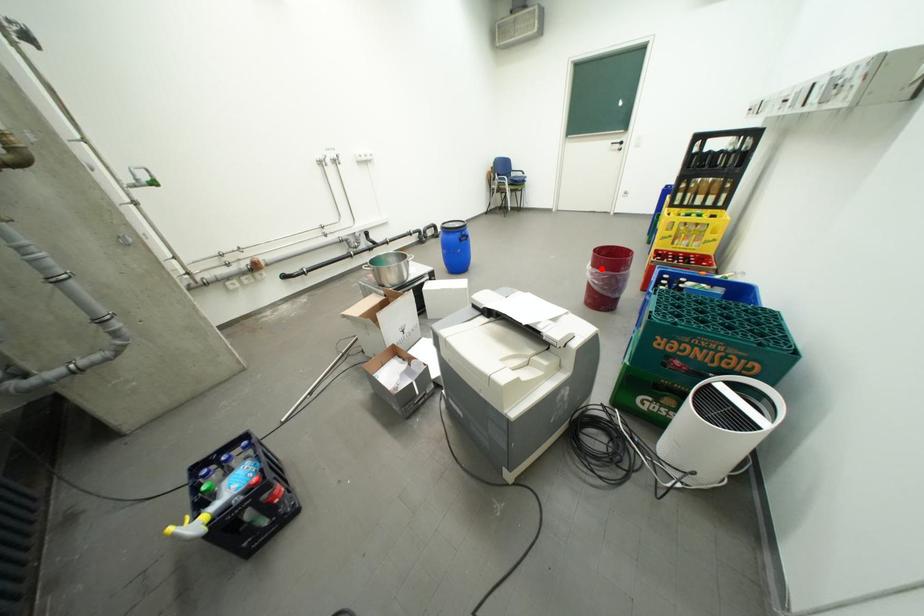
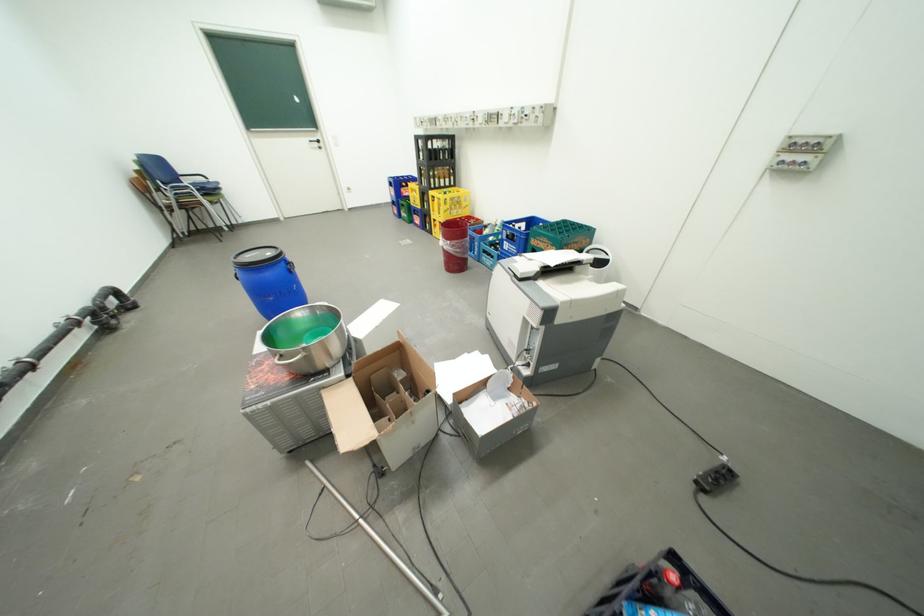
In the second image, find the point that corresponds to the highlighted location in the first image.

(459, 243)